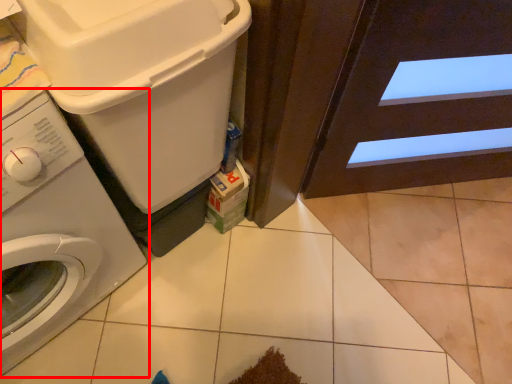
Question: From the image's perspective, what is the correct spatial positioning of washing machine (annotated by the red box) in reference to washing machine?

Choices:
 (A) above
 (B) below

Answer: (B)